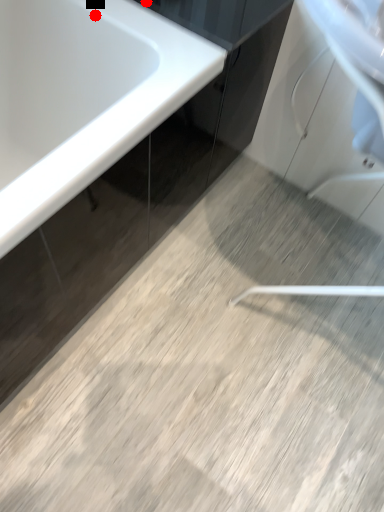
Question: Two points are circled on the image, labeled by A and B beside each circle. Which of the following is the farthest from the observer?

Choices:
 (A) A is further
 (B) B is further

Answer: (B)